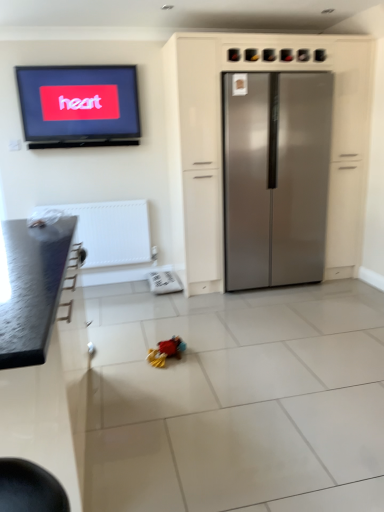
Question: Should I look upward or downward to see plush multicolored toy at center?

Choices:
 (A) down
 (B) up

Answer: (A)

Question: Is plush multicolored toy at center further to the viewer compared to satin silver refrigerator at center?

Choices:
 (A) yes
 (B) no

Answer: (B)

Question: Is satin silver refrigerator at center a part of plush multicolored toy at center?

Choices:
 (A) yes
 (B) no

Answer: (B)

Question: Would you consider plush multicolored toy at center to be distant from satin silver refrigerator at center?

Choices:
 (A) yes
 (B) no

Answer: (A)

Question: Is the surface of plush multicolored toy at center in direct contact with satin silver refrigerator at center?

Choices:
 (A) no
 (B) yes

Answer: (A)

Question: From the image's perspective, is plush multicolored toy at center located beneath satin silver refrigerator at center?

Choices:
 (A) no
 (B) yes

Answer: (B)

Question: Considering the relative positions of plush multicolored toy at center and satin silver refrigerator at center in the image provided, is plush multicolored toy at center to the left of satin silver refrigerator at center from the viewer's perspective?

Choices:
 (A) no
 (B) yes

Answer: (B)

Question: Is satin silver refrigerator at center to the right of white textured radiator at lower left from the viewer's perspective?

Choices:
 (A) yes
 (B) no

Answer: (A)

Question: Is satin silver refrigerator at center shorter than white textured radiator at lower left?

Choices:
 (A) yes
 (B) no

Answer: (B)

Question: Is white textured radiator at lower left surrounded by satin silver refrigerator at center?

Choices:
 (A) no
 (B) yes

Answer: (A)

Question: From the image's perspective, is satin silver refrigerator at center beneath white textured radiator at lower left?

Choices:
 (A) no
 (B) yes

Answer: (A)

Question: Is satin silver refrigerator at center positioned far away from white textured radiator at lower left?

Choices:
 (A) no
 (B) yes

Answer: (B)

Question: Is satin silver refrigerator at center thinner than white textured radiator at lower left?

Choices:
 (A) yes
 (B) no

Answer: (B)

Question: Does stainless steel refrigerator at center, the 2th cabinetry when ordered from left to right, have a larger size compared to plush multicolored toy at center?

Choices:
 (A) no
 (B) yes

Answer: (B)